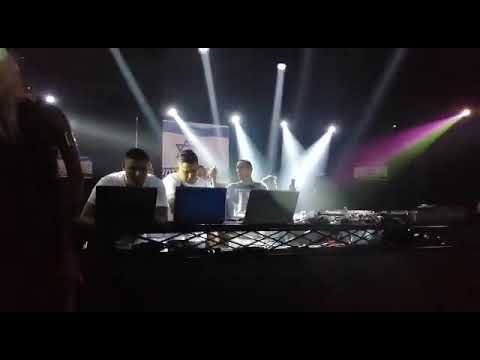
Where is `black laptop lid`? This screenshot has height=360, width=480. black laptop lid is located at coordinates (125, 203).